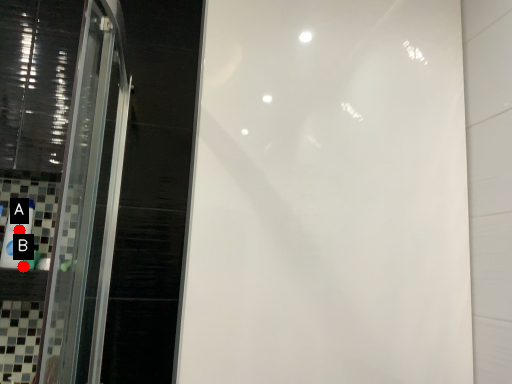
Question: Two points are circled on the image, labeled by A and B beside each circle. Which of the following is the farthest from the observer?

Choices:
 (A) A is further
 (B) B is further

Answer: (A)